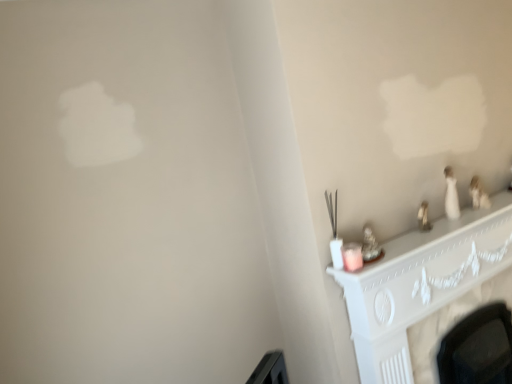
Question: Looking at their shapes, would you say white carved fireplace at lower right is wider or thinner than matte white candle at right?

Choices:
 (A) thin
 (B) wide

Answer: (B)

Question: Does point (353, 283) appear closer or farther from the camera than point (357, 251)?

Choices:
 (A) closer
 (B) farther

Answer: (B)

Question: Considering the relative positions of white carved fireplace at lower right and matte white candle at right in the image provided, is white carved fireplace at lower right to the left or to the right of matte white candle at right?

Choices:
 (A) right
 (B) left

Answer: (A)

Question: Considering the positions of matte white candle at right and white carved fireplace at lower right in the image, is matte white candle at right taller or shorter than white carved fireplace at lower right?

Choices:
 (A) short
 (B) tall

Answer: (A)

Question: Is point (344, 246) closer or farther from the camera than point (422, 286)?

Choices:
 (A) closer
 (B) farther

Answer: (A)

Question: Is matte white candle at right to the left or to the right of white carved fireplace at lower right in the image?

Choices:
 (A) right
 (B) left

Answer: (B)

Question: From a real-world perspective, relative to white carved fireplace at lower right, is matte white candle at right vertically above or below?

Choices:
 (A) above
 (B) below

Answer: (A)